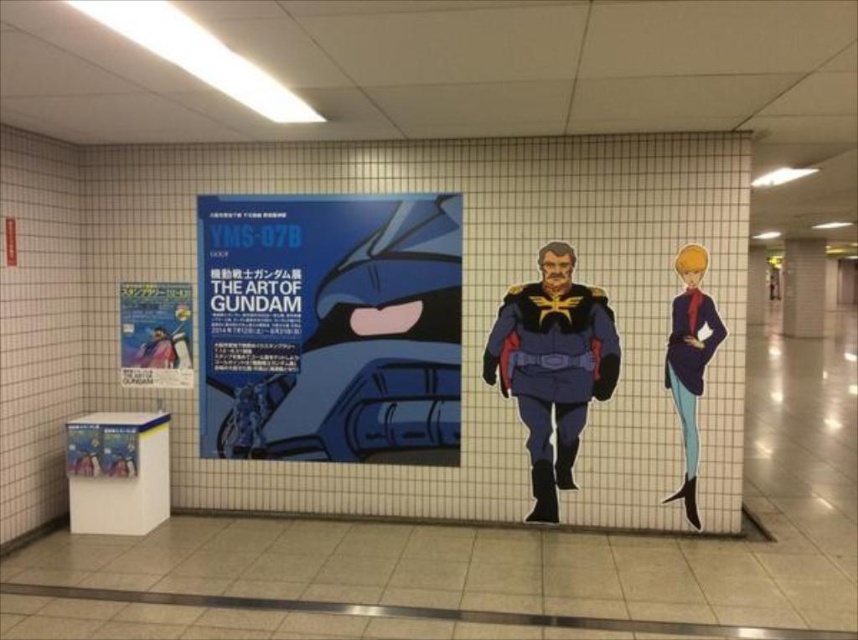
Does blue fabric uniform at center appear over smooth blue suit at right?

Indeed, blue fabric uniform at center is positioned over smooth blue suit at right.

Is point (551, 474) positioned after point (677, 326)?

Yes, point (551, 474) is farther from viewer.

The width and height of the screenshot is (858, 640). In order to click on blue fabric uniform at center in this screenshot , I will do (x=553, y=365).

Is point (414, 260) closer to camera compared to point (599, 374)?

No, (414, 260) is behind (599, 374).

Between point (257, 364) and point (572, 387), which one is positioned behind?

Positioned behind is point (257, 364).

Is point (231, 234) positioned in front of point (551, 305)?

No, (231, 234) is further to viewer.

At what (x,y) coordinates should I click in order to perform the action: click on blue matte poster at center. Please return your answer as a coordinate pair (x, y). Looking at the image, I should click on (329, 324).

Between blue matte poster at center and smooth blue suit at right, which one is positioned higher?

Positioned higher is blue matte poster at center.

Looking at this image, is blue matte poster at center to the right of smooth blue suit at right from the viewer's perspective?

In fact, blue matte poster at center is to the left of smooth blue suit at right.

Who is more forward, (455, 282) or (707, 310)?

Positioned in front is point (707, 310).

This screenshot has height=640, width=858. In order to click on blue matte poster at center in this screenshot , I will do `click(329, 324)`.